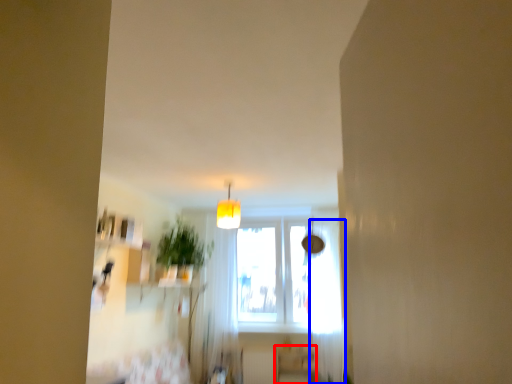
Question: Which object is closer to the camera taking this photo, furniture (highlighted by a red box) or curtain (highlighted by a blue box)?

Choices:
 (A) furniture
 (B) curtain

Answer: (B)